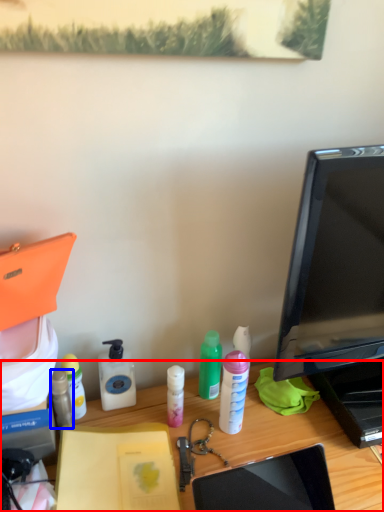
Question: Which object is further to the camera taking this photo, desk (highlighted by a red box) or bottle (highlighted by a blue box)?

Choices:
 (A) desk
 (B) bottle

Answer: (B)